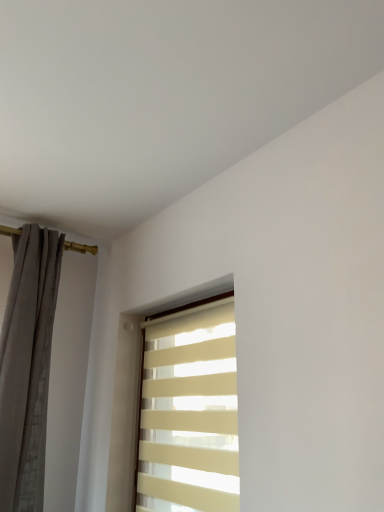
Where is `gray textured curtain at left`? This screenshot has height=512, width=384. gray textured curtain at left is located at coordinates (27, 366).

Describe the element at coordinates (27, 366) in the screenshot. The width and height of the screenshot is (384, 512). I see `gray textured curtain at left` at that location.

The image size is (384, 512). I want to click on beige striped window at center, so click(189, 411).

Describe the element at coordinates (189, 411) in the screenshot. I see `beige striped window at center` at that location.

Where is `gray textured curtain at left`? The width and height of the screenshot is (384, 512). gray textured curtain at left is located at coordinates (27, 366).

Does beige striped window at center appear on the left side of gray textured curtain at left?

Incorrect, beige striped window at center is not on the left side of gray textured curtain at left.

From the picture: Between beige striped window at center and gray textured curtain at left, which one is positioned behind?

gray textured curtain at left is further away from the camera.

Is point (154, 406) less distant than point (50, 336)?

Yes, it is in front of point (50, 336).

From the image's perspective, between beige striped window at center and gray textured curtain at left, who is located below?

beige striped window at center appears lower in the image.

From a real-world perspective, is beige striped window at center positioned over gray textured curtain at left based on gravity?

No, from a real-world perspective, beige striped window at center is not on top of gray textured curtain at left.

Between beige striped window at center and gray textured curtain at left, which one has larger width?

With larger width is gray textured curtain at left.

Looking at this image, can you confirm if beige striped window at center is taller than gray textured curtain at left?

No, beige striped window at center is not taller than gray textured curtain at left.

Looking at the image, does beige striped window at center seem bigger or smaller compared to gray textured curtain at left?

Considering their sizes, beige striped window at center takes up less space than gray textured curtain at left.

Is beige striped window at center spatially inside gray textured curtain at left, or outside of it?

beige striped window at center is outside gray textured curtain at left.

Is beige striped window at center directly adjacent to gray textured curtain at left?

No.

Is beige striped window at center facing away from gray textured curtain at left?

No, beige striped window at center's orientation is not away from gray textured curtain at left.

What are the coordinates of `window on the right side of gray textured curtain at left` in the screenshot? It's located at (189, 411).

Which is more to the left, gray textured curtain at left or beige striped window at center?

From the viewer's perspective, gray textured curtain at left appears more on the left side.

Considering the positions of objects gray textured curtain at left and beige striped window at center in the image provided, who is in front, gray textured curtain at left or beige striped window at center?

beige striped window at center is closer to the camera.

Between point (31, 331) and point (142, 487), which one is positioned behind?

The point (31, 331) is farther from the camera.

From the image's perspective, which object appears higher, gray textured curtain at left or beige striped window at center?

From the image's view, gray textured curtain at left is above.

From a real-world perspective, is gray textured curtain at left positioned over beige striped window at center based on gravity?

Yes, from a real-world perspective, gray textured curtain at left is over beige striped window at center

Considering the relative sizes of gray textured curtain at left and beige striped window at center in the image provided, is gray textured curtain at left thinner than beige striped window at center?

No.

Is gray textured curtain at left taller than beige striped window at center?

Yes.

Looking at this image, considering the sizes of objects gray textured curtain at left and beige striped window at center in the image provided, who is smaller, gray textured curtain at left or beige striped window at center?

Smaller between the two is beige striped window at center.

Can beige striped window at center be found inside gray textured curtain at left?

No, gray textured curtain at left does not contain beige striped window at center.

Is gray textured curtain at left positioned far away from beige striped window at center?

Actually, gray textured curtain at left and beige striped window at center are a little close together.

Is gray textured curtain at left looking in the opposite direction of beige striped window at center?

That's not correct — gray textured curtain at left is not looking away from beige striped window at center.

Locate an element on the screen. window on the right of gray textured curtain at left is located at coordinates (189, 411).

Identify the location of curtain to the left of beige striped window at center. (27, 366).

The height and width of the screenshot is (512, 384). I want to click on curtain located above the beige striped window at center (from the image's perspective), so click(27, 366).